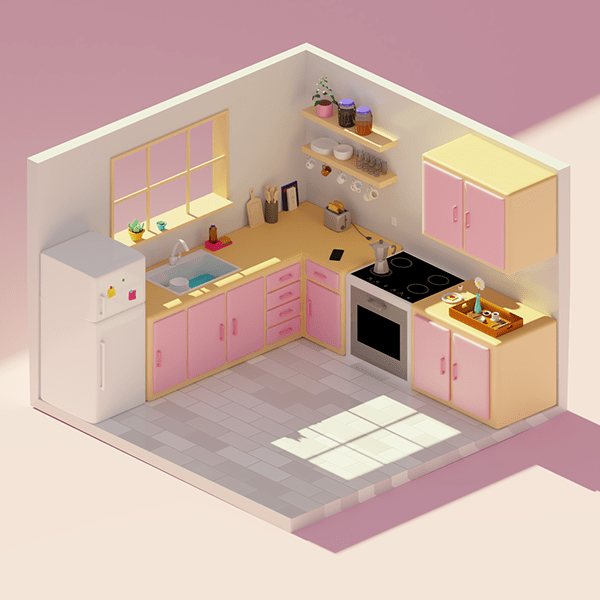
The height and width of the screenshot is (600, 600). I want to click on gray coffee pot on stove, so click(379, 257).